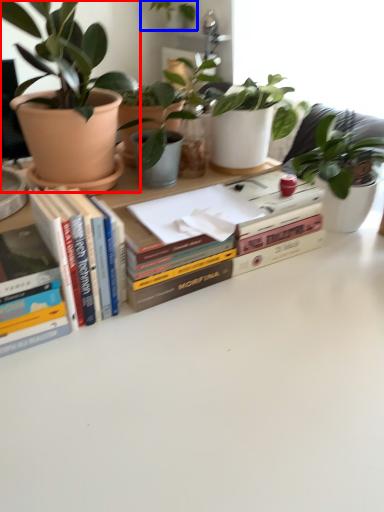
Question: Which object is closer to the camera taking this photo, houseplant (highlighted by a red box) or houseplant (highlighted by a blue box)?

Choices:
 (A) houseplant
 (B) houseplant

Answer: (A)